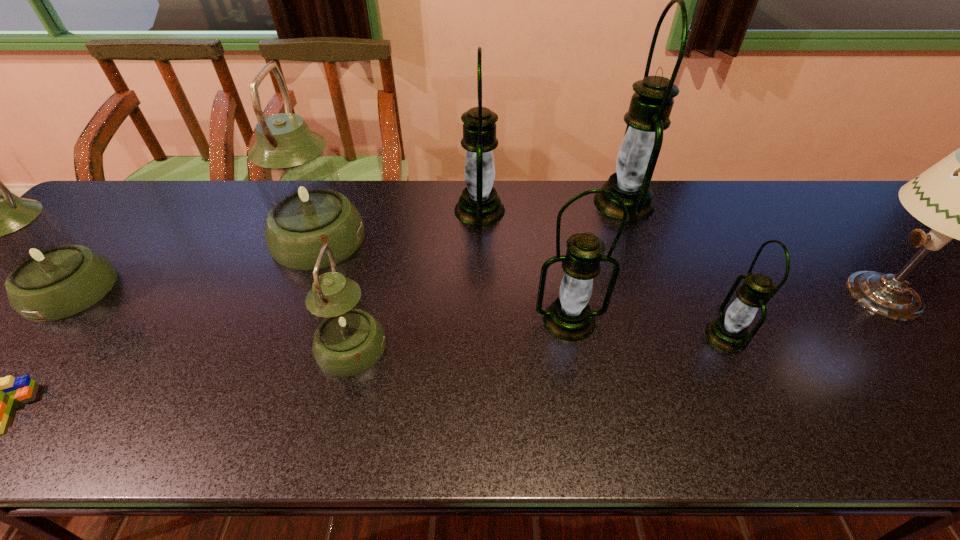
Find the location of `the tallest object`. the tallest object is located at coordinates pyautogui.click(x=651, y=104).

You are a GUI agent. You are given a task and a screenshot of the screen. Output one action in this format:
    pyautogui.click(x=<x>, y=<y>)
    Task: Click on the tallest lantern
    Image resolution: width=960 pixels, height=540 pixels.
    Given the screenshot: What is the action you would take?
    pyautogui.click(x=651, y=104)

Locate an element on the screen. The height and width of the screenshot is (540, 960). the third smallest green lantern is located at coordinates (479, 205).

Identify the location of the leftmost green lantern. (479, 205).

Where is `the biggest greenish lantern`? The height and width of the screenshot is (540, 960). the biggest greenish lantern is located at coordinates (298, 182).

Locate an element on the screen. The image size is (960, 540). the rightmost object is located at coordinates (959, 197).

Where is `the third lantern from right to left`? The height and width of the screenshot is (540, 960). the third lantern from right to left is located at coordinates (570, 318).

Locate an element on the screen. Image resolution: width=960 pixels, height=540 pixels. the third green lantern from right to left is located at coordinates 570,318.

Where is `the smallest green lantern`? This screenshot has height=540, width=960. the smallest green lantern is located at coordinates (729, 332).

Find the location of `the smallest greenish lantern`. the smallest greenish lantern is located at coordinates (347, 341).